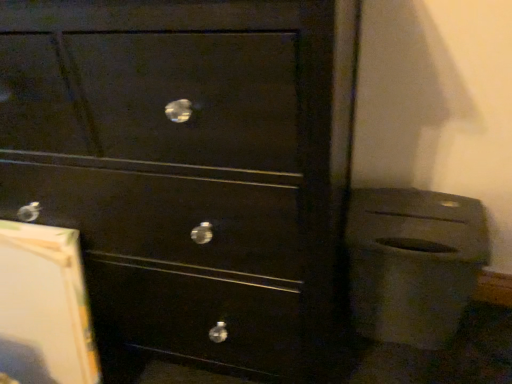
Question: From a real-world perspective, is matte black trash can at lower right positioned above or below matte black drawer at center?

Choices:
 (A) above
 (B) below

Answer: (B)

Question: Is matte black trash can at lower right in front of or behind matte black drawer at center in the image?

Choices:
 (A) behind
 (B) front

Answer: (A)

Question: Is matte black trash can at lower right inside or outside of matte black drawer at center?

Choices:
 (A) inside
 (B) outside

Answer: (B)

Question: From a real-world perspective, is matte black drawer at center above or below matte black trash can at lower right?

Choices:
 (A) below
 (B) above

Answer: (B)

Question: In the image, is matte black drawer at center positioned in front of or behind matte black trash can at lower right?

Choices:
 (A) front
 (B) behind

Answer: (A)

Question: In terms of height, does matte black drawer at center look taller or shorter compared to matte black trash can at lower right?

Choices:
 (A) tall
 (B) short

Answer: (A)

Question: Is matte black drawer at center situated inside matte black trash can at lower right or outside?

Choices:
 (A) inside
 (B) outside

Answer: (B)